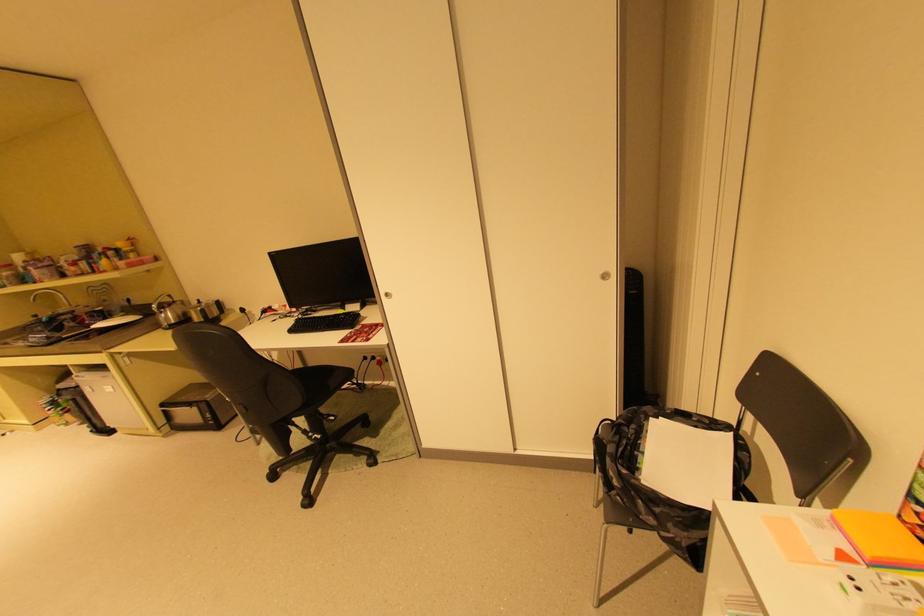
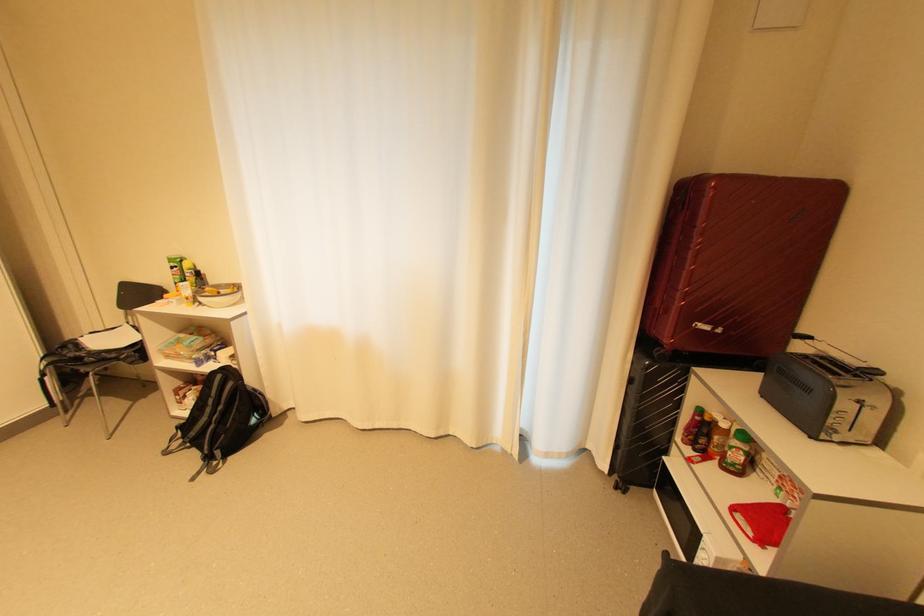
Where in the second image is the point corresponding to (x=640, y=427) from the first image?

(79, 346)